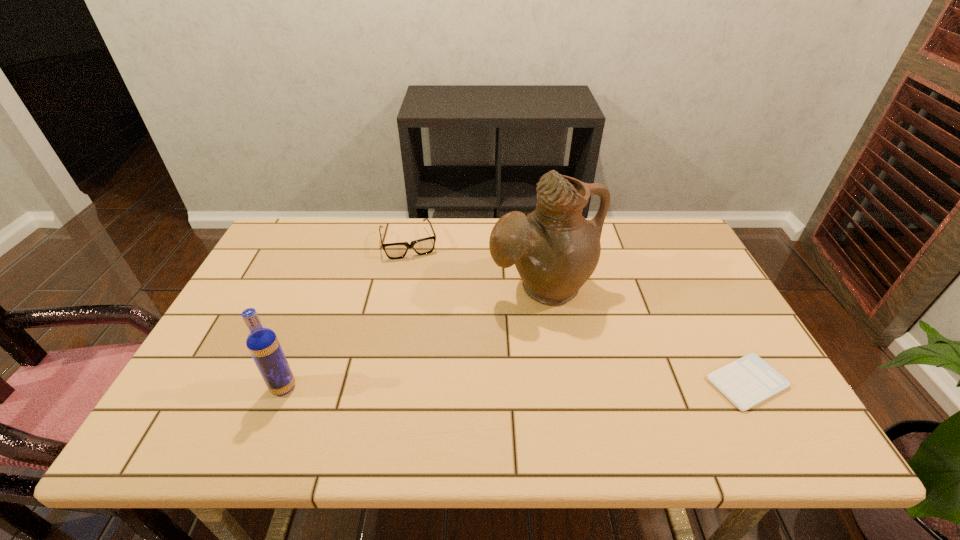
Identify the location of object situated at the right edge. (748, 381).

Identify the location of object situated at the near right corner. (748, 381).

At what (x,y) coordinates should I click in order to perform the action: click on vacant position at the far edge of the desktop. Please return your answer as a coordinate pair (x, y). The height and width of the screenshot is (540, 960). Looking at the image, I should click on (349, 241).

What are the coordinates of `vacant space at the near edge of the desktop` in the screenshot? It's located at (332, 402).

Locate an element on the screen. Image resolution: width=960 pixels, height=540 pixels. vacant space at the left edge of the desktop is located at coordinates (256, 303).

Locate an element on the screen. This screenshot has width=960, height=540. vacant space at the right edge of the desktop is located at coordinates (681, 276).

Find the location of a particular element. free space at the far left corner is located at coordinates (295, 237).

Where is `vacant position at the far right corner of the desktop`? This screenshot has height=540, width=960. vacant position at the far right corner of the desktop is located at coordinates (668, 227).

Find the location of a particular element. The image size is (960, 540). free space between the tallest object and the third shortest object is located at coordinates (413, 338).

Locate an element on the screen. This screenshot has width=960, height=540. vacant point located between the shortest object and the second farthest object is located at coordinates (644, 335).